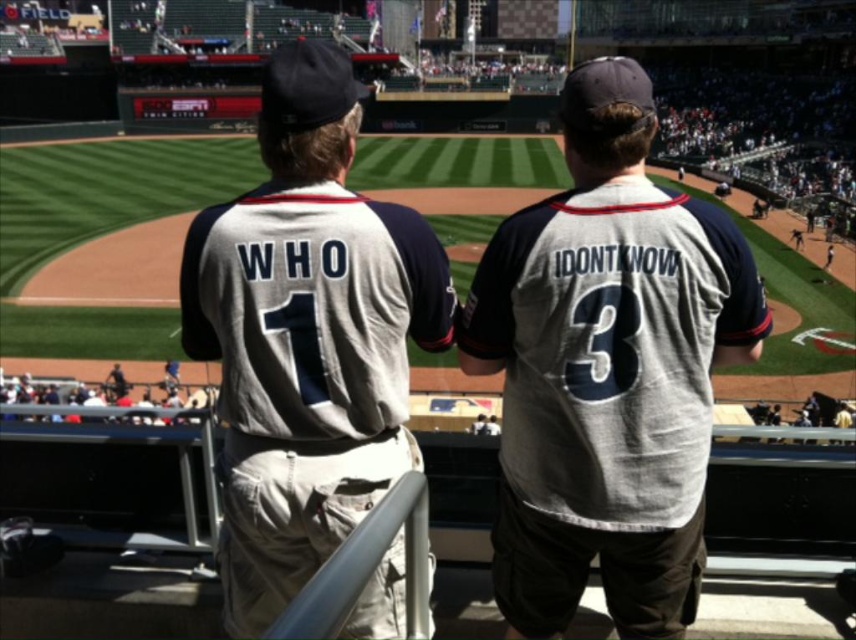
Consider the image. You are at the baseball stadium and want to walk from point (702, 486) to point (367, 324). Which direction should you move relative to your current position?

You should move forward because point (702, 486) is further to the viewer than point (367, 324), so moving towards the field would bring you closer to the latter point.

You are standing at the baseball stadium and want to throw a baseball to someone standing at the gray jersey at center. The baseball has a range of 20 meters. Can you reach them?

The gray jersey at center is 21.53 meters from viewer, which is beyond the baseball range of 20 meters. You cannot reach them.